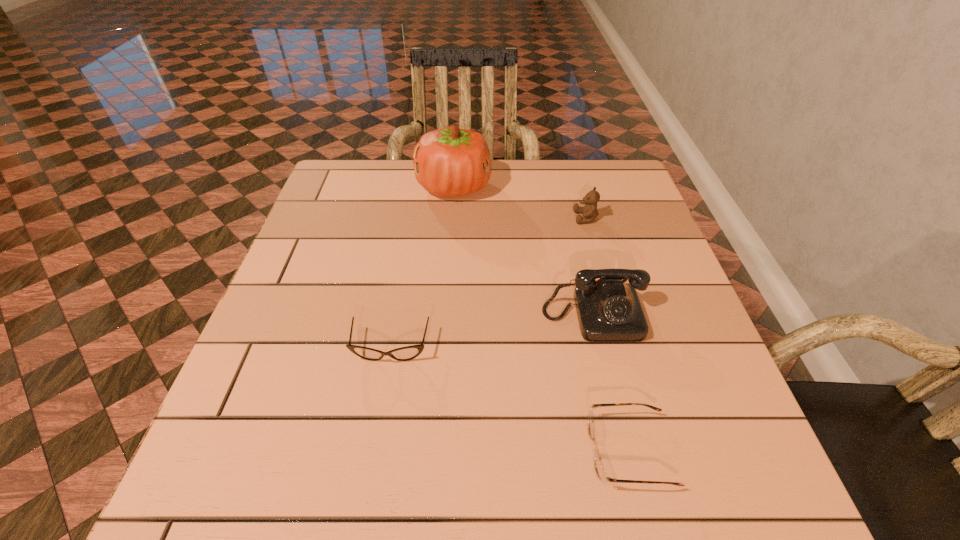
Locate an element on the screen. The height and width of the screenshot is (540, 960). telephone situated at the right edge is located at coordinates (608, 310).

Locate an element on the screen. This screenshot has height=540, width=960. teddy bear situated at the right edge is located at coordinates click(x=589, y=211).

Identify the location of spectacles located in the right edge section of the desktop. This screenshot has width=960, height=540. (599, 468).

Where is `object that is at the near right corner`? This screenshot has height=540, width=960. object that is at the near right corner is located at coordinates (599, 468).

Find the location of a particular element. The image size is (960, 540). vacant space at the far edge of the desktop is located at coordinates (389, 193).

This screenshot has width=960, height=540. In the image, there is a desktop. In order to click on vacant area at the near edge in this screenshot , I will do `click(387, 503)`.

Locate an element on the screen. vacant space at the left edge of the desktop is located at coordinates [x=324, y=282].

Where is `vacant point at the right edge`? vacant point at the right edge is located at coordinates (683, 309).

The image size is (960, 540). In the image, there is a desktop. What are the coordinates of `vacant space at the far right corner` in the screenshot? It's located at (624, 201).

This screenshot has height=540, width=960. In the image, there is a desktop. What are the coordinates of `vacant space at the near right corner` in the screenshot? It's located at click(684, 503).